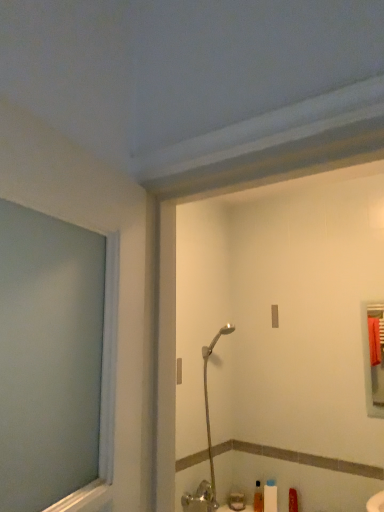
What do you see at coordinates (270, 498) in the screenshot? This screenshot has height=512, width=384. I see `white matte toilet paper at lower center` at bounding box center [270, 498].

Find the location of a particular element. This screenshot has height=512, width=384. translucent plastic soap dispenser at lower center is located at coordinates (258, 498).

Would you say silver metallic shower head at center is part of translucent plastic soap dispenser at lower center's contents?

No, silver metallic shower head at center is not a part of translucent plastic soap dispenser at lower center.

Does translucent plastic soap dispenser at lower center lie behind silver metallic shower head at center?

Yes, it is behind silver metallic shower head at center.

Which is more to the left, translucent plastic soap dispenser at lower center or silver metallic shower head at center?

Positioned to the left is silver metallic shower head at center.

From the image's perspective, would you say translucent plastic soap dispenser at lower center is shown under silver metallic shower head at center?

Indeed, from the image's perspective, translucent plastic soap dispenser at lower center is shown beneath silver metallic shower head at center.

Who is bigger, silver metallic shower head at center or translucent plastic soap dispenser at lower center?

Bigger between the two is silver metallic shower head at center.

At what (x,y) coordinates should I click in order to perform the action: click on toiletry below the silver metallic shower head at center (from the image's perspective). Please return your answer as a coordinate pair (x, y). Looking at the image, I should click on (258, 498).

From the image's perspective, between silver metallic shower head at center and translucent plastic soap dispenser at lower center, which one is located above?

silver metallic shower head at center is shown above in the image.

Where is `toilet paper that appears on the right of silver metallic shower head at center`? toilet paper that appears on the right of silver metallic shower head at center is located at coordinates (270, 498).

From the image's perspective, which one is positioned lower, silver metallic shower head at center or white matte toilet paper at lower center?

white matte toilet paper at lower center.

Considering the sizes of objects silver metallic shower head at center and white matte toilet paper at lower center in the image provided, who is bigger, silver metallic shower head at center or white matte toilet paper at lower center?

With larger size is silver metallic shower head at center.

Can you tell me how much white matte toilet paper at lower center and silver metallic shower head at center differ in facing direction?

They differ by 89.7 degrees in their facing directions.

Which of these two, white matte toilet paper at lower center or silver metallic shower head at center, stands shorter?

white matte toilet paper at lower center is shorter.

From a real-world perspective, which is physically below, white matte toilet paper at lower center or silver metallic shower head at center?

white matte toilet paper at lower center is physically lower.

Which of these two, white matte toilet paper at lower center or silver metallic shower head at center, is thinner?

white matte toilet paper at lower center is thinner.

Which of these two, white matte toilet paper at lower center or translucent plastic soap dispenser at lower center, is smaller?

translucent plastic soap dispenser at lower center is smaller.

Considering the points (268, 490) and (258, 497), which point is in front, point (268, 490) or point (258, 497)?

The point (268, 490) is closer.

Where is `toiletry lying below the white matte toilet paper at lower center (from the image's perspective)`? The width and height of the screenshot is (384, 512). toiletry lying below the white matte toilet paper at lower center (from the image's perspective) is located at coordinates (258, 498).

Is translucent plastic soap dispenser at lower center a part of white matte toilet paper at lower center?

No, translucent plastic soap dispenser at lower center is not inside white matte toilet paper at lower center.

From a real-world perspective, is translucent plastic soap dispenser at lower center beneath white matte toilet paper at lower center?

Indeed, from a real-world perspective, translucent plastic soap dispenser at lower center is positioned beneath white matte toilet paper at lower center.

Considering the relative sizes of translucent plastic soap dispenser at lower center and white matte toilet paper at lower center in the image provided, is translucent plastic soap dispenser at lower center wider than white matte toilet paper at lower center?

No, translucent plastic soap dispenser at lower center is not wider than white matte toilet paper at lower center.

Which of these two, translucent plastic soap dispenser at lower center or white matte toilet paper at lower center, stands shorter?

Standing shorter between the two is translucent plastic soap dispenser at lower center.

Is point (259, 490) closer or farther from the camera than point (271, 494)?

Clearly, point (259, 490) is more distant from the camera than point (271, 494).

Find the location of a particular element. The image size is (384, 512). shower in front of the translucent plastic soap dispenser at lower center is located at coordinates (208, 410).

Identify the location of toiletry on the right of the silver metallic shower head at center. The width and height of the screenshot is (384, 512). (258, 498).

From the picture: When comparing their distances from white matte toilet paper at lower center, does translucent plastic soap dispenser at lower center or silver metallic shower head at center seem closer?

Based on the image, translucent plastic soap dispenser at lower center appears to be nearer to white matte toilet paper at lower center.

Estimate the real-world distances between objects in this image. Which object is closer to silver metallic shower head at center, translucent plastic soap dispenser at lower center or white matte toilet paper at lower center?

translucent plastic soap dispenser at lower center is closer to silver metallic shower head at center.

When comparing their distances from white matte toilet paper at lower center, does silver metallic shower head at center or translucent plastic soap dispenser at lower center seem further?

Among the two, silver metallic shower head at center is located further to white matte toilet paper at lower center.

From the image, which object appears to be farther from translucent plastic soap dispenser at lower center, white matte toilet paper at lower center or silver metallic shower head at center?

silver metallic shower head at center is positioned further to the anchor translucent plastic soap dispenser at lower center.

Looking at the image, which one is located further to translucent plastic soap dispenser at lower center, silver metallic shower head at center or white matte toilet paper at lower center?

silver metallic shower head at center is further to translucent plastic soap dispenser at lower center.

Based on their spatial positions, is white matte toilet paper at lower center or translucent plastic soap dispenser at lower center closer to silver metallic shower head at center?

Among the two, translucent plastic soap dispenser at lower center is located nearer to silver metallic shower head at center.

Identify the location of toilet paper between silver metallic shower head at center and translucent plastic soap dispenser at lower center in the vertical direction. The image size is (384, 512). (270, 498).